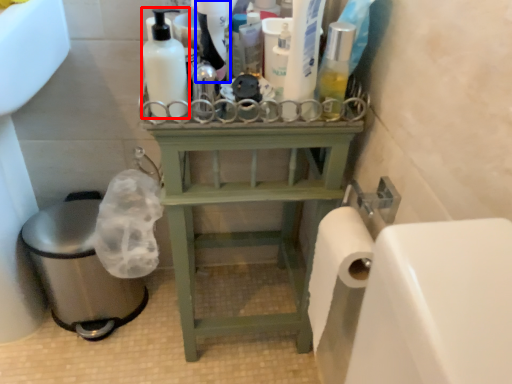
Question: Among these objects, which one is nearest to the camera, cleaning product (highlighted by a red box) or cleaning product (highlighted by a blue box)?

Choices:
 (A) cleaning product
 (B) cleaning product

Answer: (A)